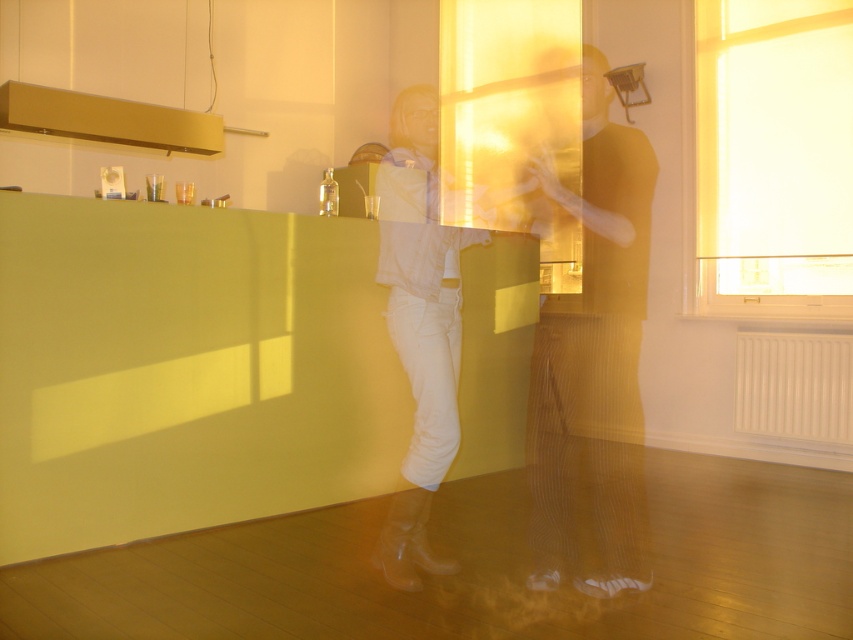
How distant is white fabric at right from matte gold tank top at center?

They are 5.35 feet apart.

Is white fabric at right below matte gold tank top at center?

No, white fabric at right is not below matte gold tank top at center.

Which is behind, point (683, 77) or point (605, 104)?

The point (683, 77) is behind.

Find the location of `white fabric at right`. white fabric at right is located at coordinates (772, 161).

Can you confirm if matte gold tank top at center is shorter than white leather boots at center?

No, matte gold tank top at center is not shorter than white leather boots at center.

Which is behind, point (624, 157) or point (444, 264)?

Positioned behind is point (444, 264).

The image size is (853, 640). I want to click on matte gold tank top at center, so click(595, 356).

Can you confirm if white fabric at right is taller than white leather boots at center?

Correct, white fabric at right is much taller as white leather boots at center.

Which is behind, point (722, 278) or point (444, 289)?

Point (722, 278)

What do you see at coordinates (772, 161) in the screenshot?
I see `white fabric at right` at bounding box center [772, 161].

Where is `white fabric at right`? This screenshot has height=640, width=853. white fabric at right is located at coordinates (772, 161).